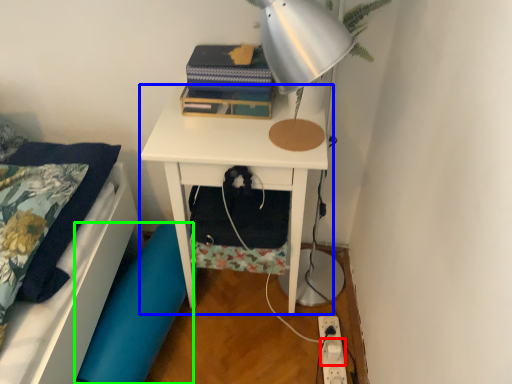
Question: Which object is the closest to the electric outlet (highlighted by a red box)? Choose among these: nightstand (highlighted by a blue box) or swivel chair (highlighted by a green box).

Choices:
 (A) nightstand
 (B) swivel chair

Answer: (B)